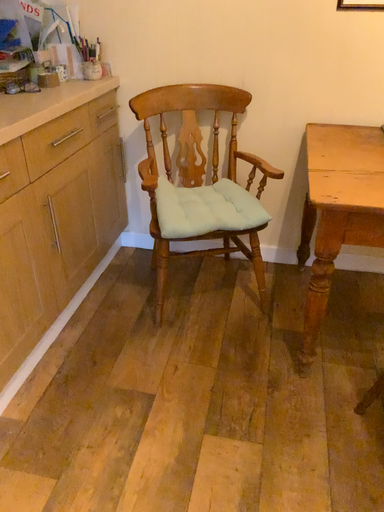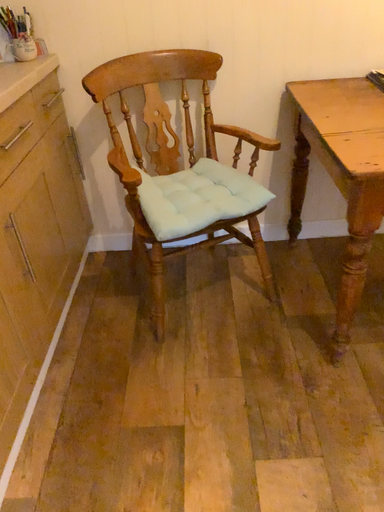
Question: How did the camera likely rotate when shooting the video?

Choices:
 (A) rotated left
 (B) rotated right

Answer: (B)